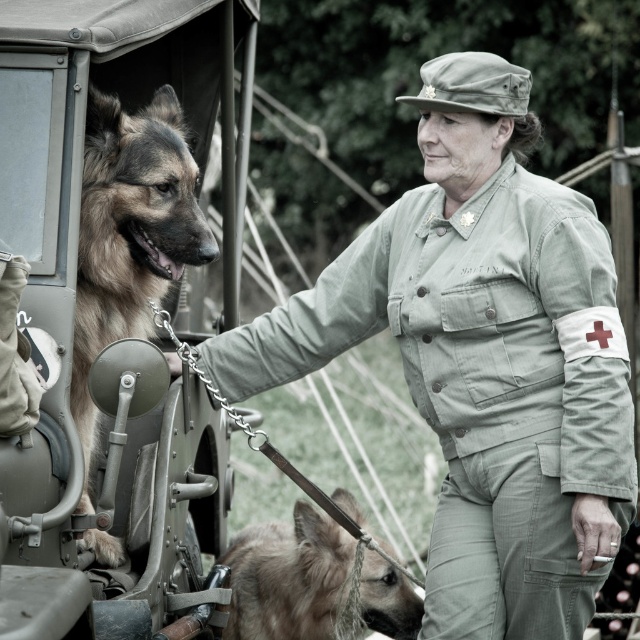
Question: Can you confirm if matte green vehicle at left is smaller than brown fur dog at left?

Choices:
 (A) no
 (B) yes

Answer: (B)

Question: Which object is closer to the camera taking this photo?

Choices:
 (A) matte green vehicle at left
 (B) light brown fur at lower center
 (C) matte khaki uniform at center
 (D) brown fur dog at left

Answer: (A)

Question: Is matte khaki uniform at center further to camera compared to light brown fur at lower center?

Choices:
 (A) yes
 (B) no

Answer: (B)

Question: Which point appears closest to the camera in this image?

Choices:
 (A) click(x=154, y=106)
 (B) click(x=449, y=480)
 (C) click(x=202, y=532)
 (D) click(x=332, y=573)

Answer: (A)

Question: Among these points, which one is nearest to the camera?

Choices:
 (A) (141, 625)
 (B) (268, 611)
 (C) (476, 426)
 (D) (113, 248)

Answer: (A)

Question: Can you confirm if matte khaki uniform at center is thinner than light brown fur at lower center?

Choices:
 (A) yes
 (B) no

Answer: (B)